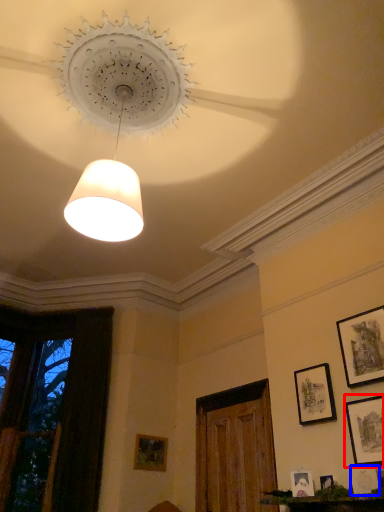
Question: Among these objects, which one is nearest to the camera, picture frame (highlighted by a red box) or picture frame (highlighted by a blue box)?

Choices:
 (A) picture frame
 (B) picture frame

Answer: (B)